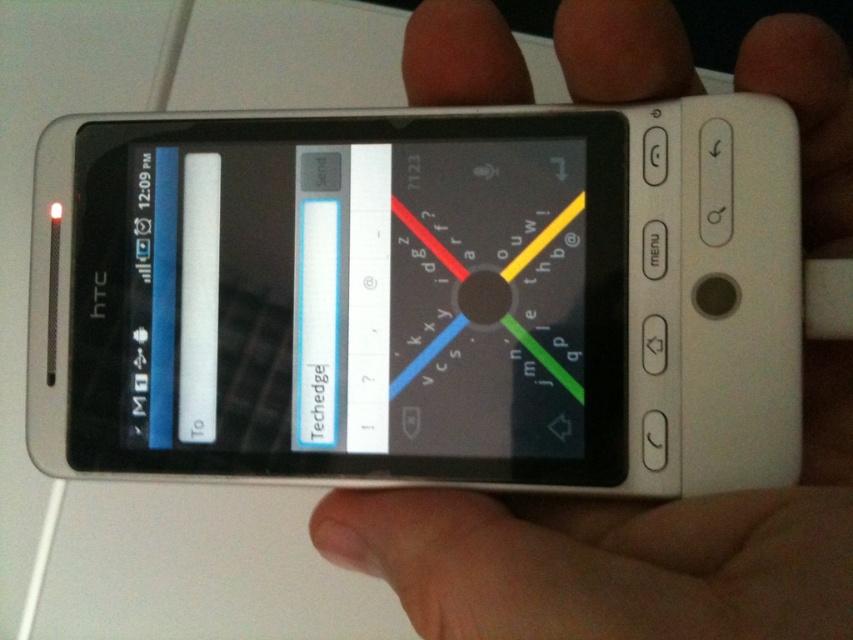
Question: Which of the following is the farthest from the observer?

Choices:
 (A) satin white phone at center
 (B) white matte hand at center

Answer: (A)

Question: Which object appears farthest from the camera in this image?

Choices:
 (A) white matte hand at center
 (B) satin white phone at center

Answer: (B)

Question: Does satin white phone at center appear under white matte hand at center?

Choices:
 (A) no
 (B) yes

Answer: (A)

Question: Is satin white phone at center smaller than white matte hand at center?

Choices:
 (A) no
 (B) yes

Answer: (B)

Question: Can you confirm if satin white phone at center is bigger than white matte hand at center?

Choices:
 (A) yes
 (B) no

Answer: (B)